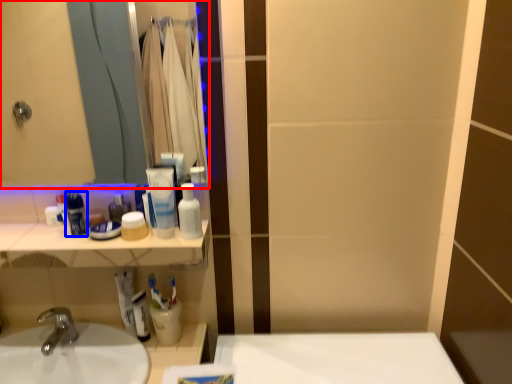
Question: Which object is further to the camera taking this photo, mirror (highlighted by a red box) or mouthwash (highlighted by a blue box)?

Choices:
 (A) mirror
 (B) mouthwash

Answer: (B)